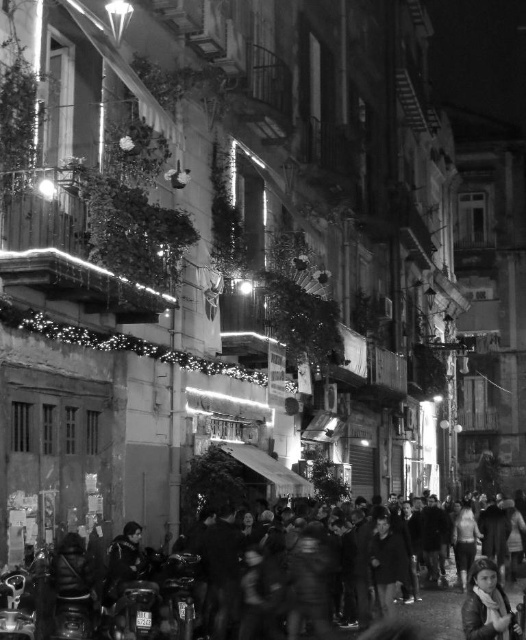
From the picture: Who is lower down, light brown hair at lower right or dark textured coat at lower left?

light brown hair at lower right is lower down.

The height and width of the screenshot is (640, 526). Describe the element at coordinates (487, 604) in the screenshot. I see `light brown hair at lower right` at that location.

This screenshot has height=640, width=526. Find the location of `light brown hair at lower right`. light brown hair at lower right is located at coordinates (487, 604).

Image resolution: width=526 pixels, height=640 pixels. Identify the location of light brown hair at lower right. (487, 604).